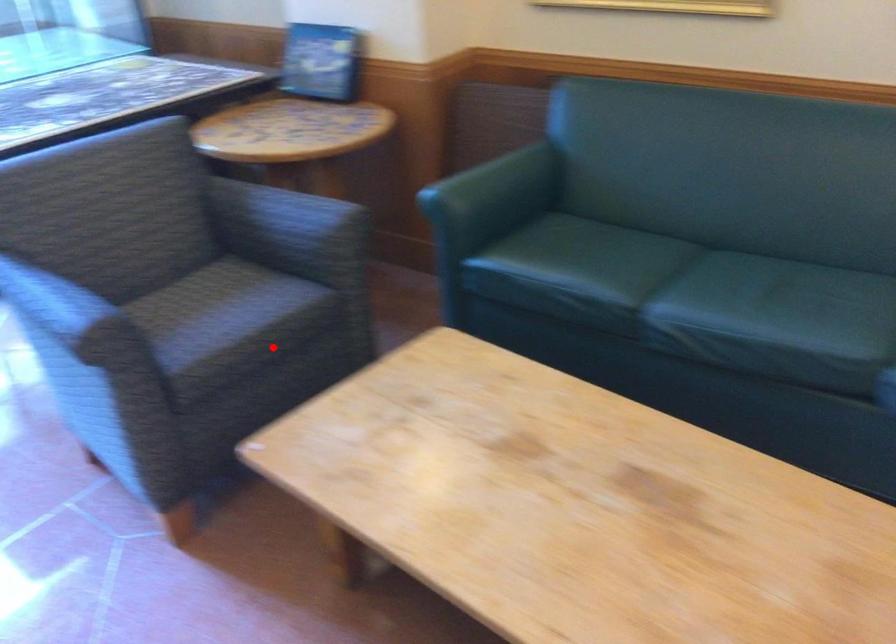
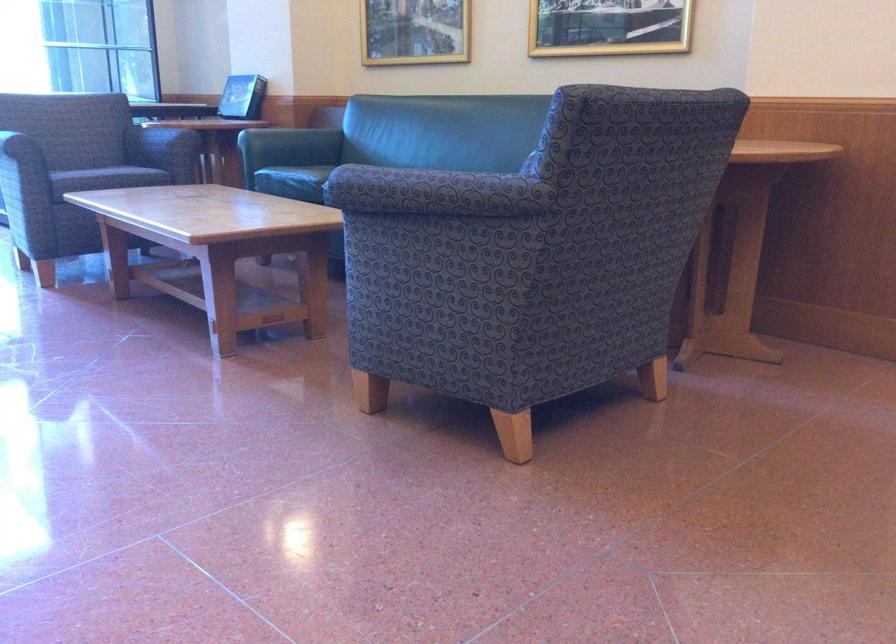
Find the pixel in the second image that matches the highlighted location in the first image.

(115, 176)